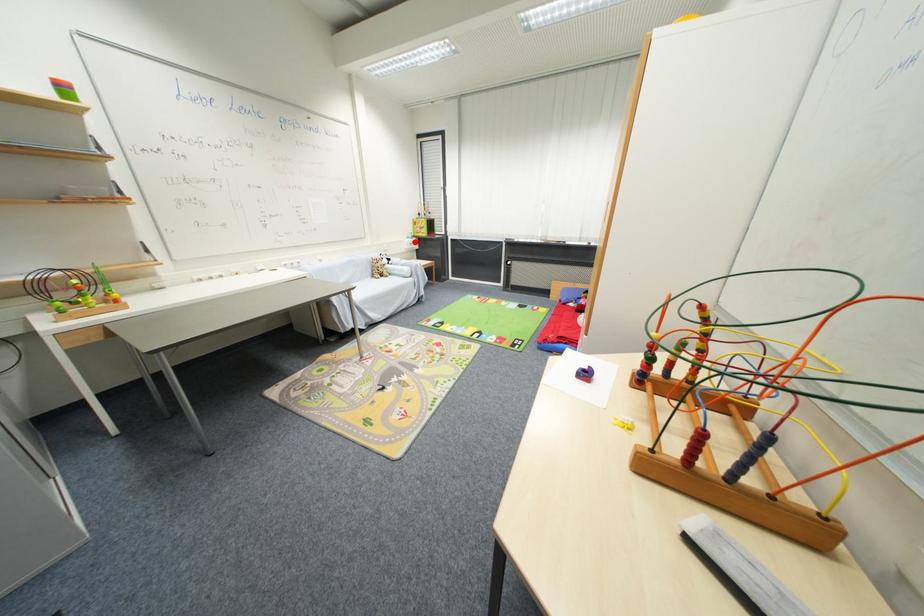
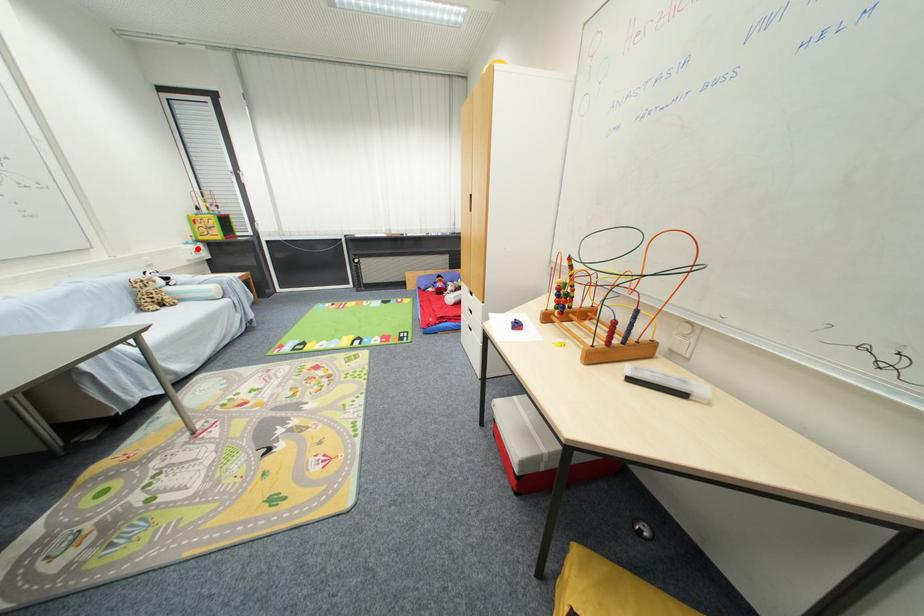
I am providing you with two images of the same scene from different viewpoints. A red point is marked on the first image and another point is marked on the second image. Does the point marked in image1 correspond to the same location as the one in image2?

Yes